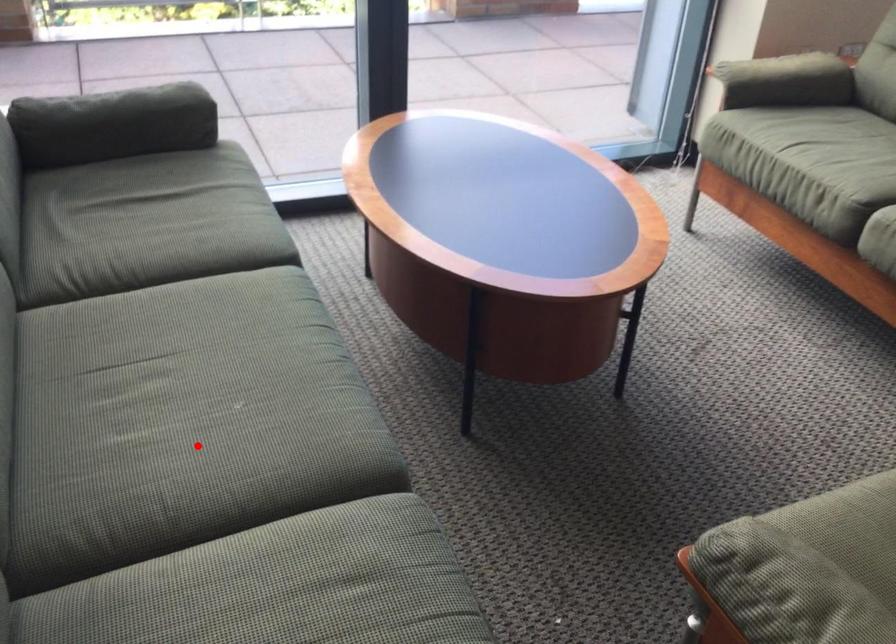
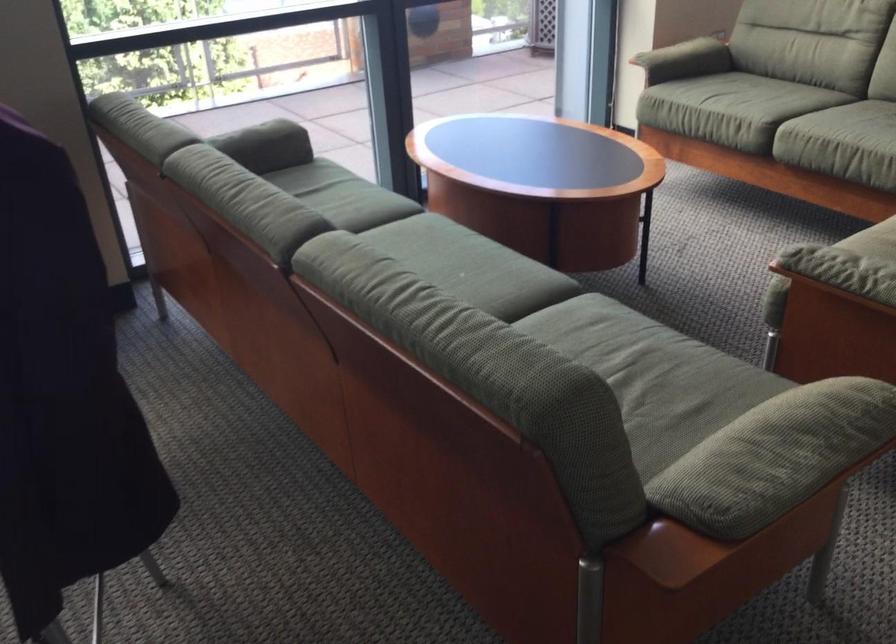
Question: I am providing you with two images of the same scene from different viewpoints. A red point is marked on the first image. Is the red point's position out of view in image 2?

Choices:
 (A) Yes
 (B) No

Answer: (A)